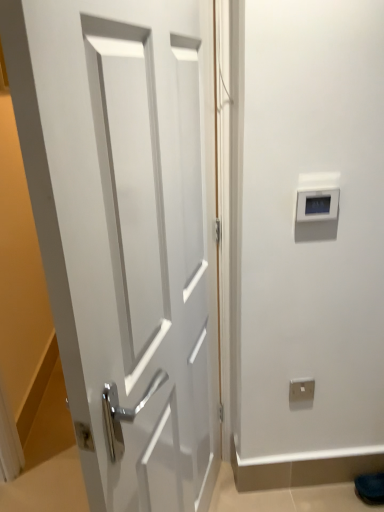
Question: Do you think gray plastic thermostat at upper right is within white glossy door at center, or outside of it?

Choices:
 (A) inside
 (B) outside

Answer: (B)

Question: Based on their sizes in the image, would you say gray plastic thermostat at upper right is bigger or smaller than white glossy door at center?

Choices:
 (A) small
 (B) big

Answer: (A)

Question: Estimate the real-world distances between objects in this image. Which object is farther from the gray plastic thermostat at upper right?

Choices:
 (A) white glossy door at center
 (B) white plastic electric outlet at lower center

Answer: (B)

Question: Which of these objects is positioned closest to the white plastic electric outlet at lower center?

Choices:
 (A) white glossy door at center
 (B) gray plastic thermostat at upper right

Answer: (B)